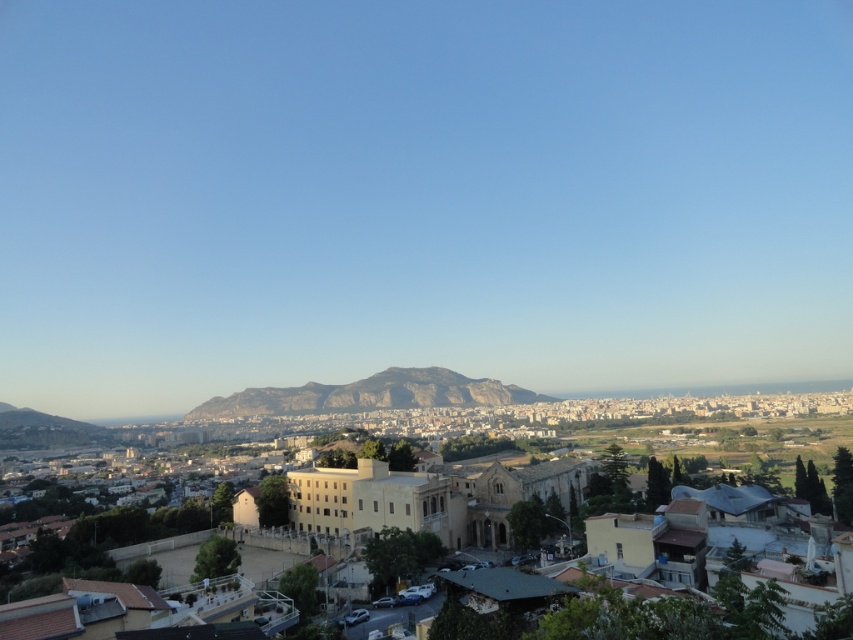
Does beige stone church at center have a greater height compared to rugged brown rock at center?

Yes.

Is point (804, 404) in front of point (276, 413)?

No, it is not.

I want to click on beige stone church at center, so click(427, 499).